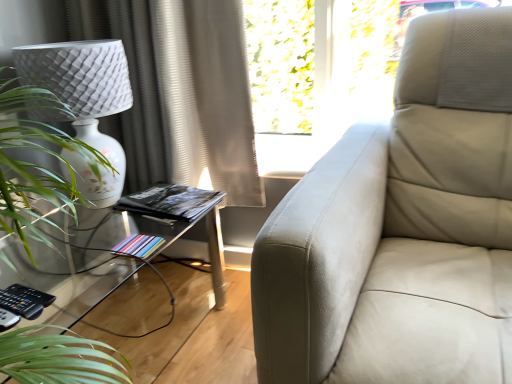
Question: Is green leafy plant at left turned away from clear glass table at lower left?

Choices:
 (A) no
 (B) yes

Answer: (A)

Question: Does green leafy plant at left have a larger size compared to clear glass table at lower left?

Choices:
 (A) yes
 (B) no

Answer: (B)

Question: Can you confirm if green leafy plant at left is taller than clear glass table at lower left?

Choices:
 (A) no
 (B) yes

Answer: (B)

Question: Is clear glass table at lower left a part of green leafy plant at left?

Choices:
 (A) yes
 (B) no

Answer: (B)

Question: Is green leafy plant at left located outside clear glass table at lower left?

Choices:
 (A) yes
 (B) no

Answer: (A)

Question: Is green leafy plant at left thinner than clear glass table at lower left?

Choices:
 (A) no
 (B) yes

Answer: (B)

Question: Considering the relative positions of beige textured curtain at upper left and clear glass table at lower left in the image provided, is beige textured curtain at upper left to the left of clear glass table at lower left from the viewer's perspective?

Choices:
 (A) yes
 (B) no

Answer: (B)

Question: Can you confirm if beige textured curtain at upper left is thinner than clear glass table at lower left?

Choices:
 (A) no
 (B) yes

Answer: (B)

Question: Can you confirm if beige textured curtain at upper left is shorter than clear glass table at lower left?

Choices:
 (A) yes
 (B) no

Answer: (B)

Question: From the image's perspective, is beige textured curtain at upper left beneath clear glass table at lower left?

Choices:
 (A) yes
 (B) no

Answer: (B)

Question: Is the depth of beige textured curtain at upper left greater than that of clear glass table at lower left?

Choices:
 (A) no
 (B) yes

Answer: (B)

Question: Is clear glass table at lower left completely or partially inside beige textured curtain at upper left?

Choices:
 (A) yes
 (B) no

Answer: (B)

Question: Does beige textured curtain at upper left come in front of pastel paper book at lower left, which appears as the 1th book when viewed from the front?

Choices:
 (A) no
 (B) yes

Answer: (A)